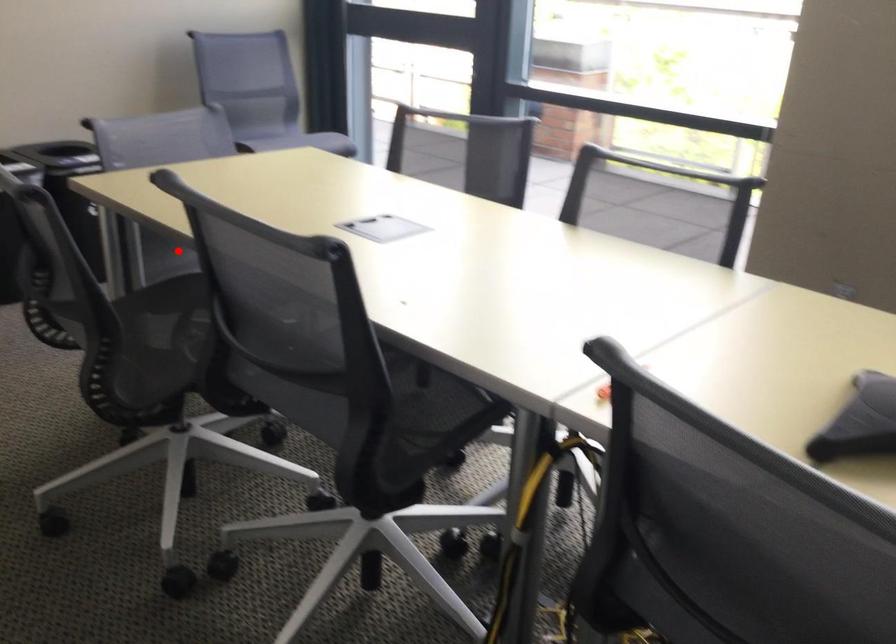
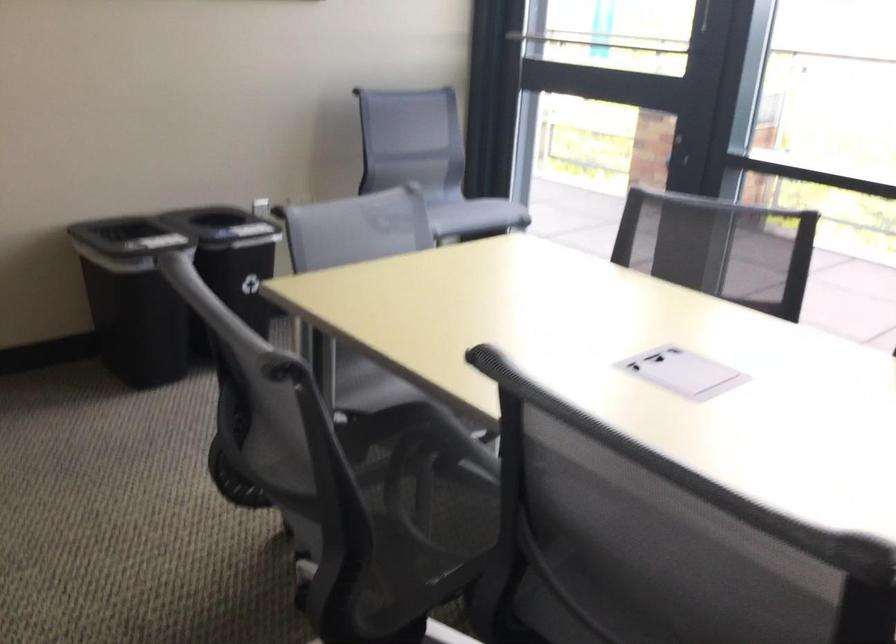
Find the pixel in the second image that matches the highlighted location in the first image.

(356, 361)